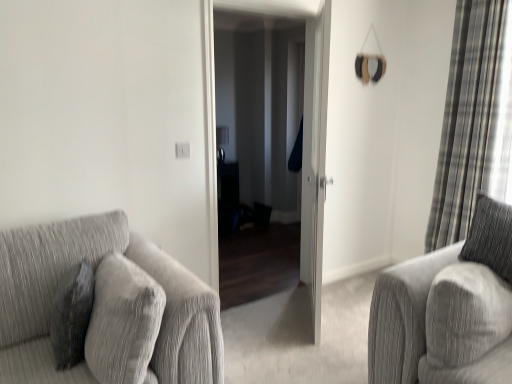
Question: Is white glossy door at center, placed as the first screen door when sorted from right to left, located outside textured gray couch at left?

Choices:
 (A) no
 (B) yes

Answer: (B)

Question: From the image's perspective, would you say white glossy door at center, placed as the second screen door when sorted from left to right, is shown under textured gray couch at left?

Choices:
 (A) no
 (B) yes

Answer: (A)

Question: Would you say textured gray couch at left is part of white glossy door at center, placed as the first screen door when sorted from right to left,'s contents?

Choices:
 (A) no
 (B) yes

Answer: (A)

Question: Can you confirm if white glossy door at center, placed as the second screen door when sorted from left to right, is taller than textured gray couch at left?

Choices:
 (A) yes
 (B) no

Answer: (A)

Question: From a real-world perspective, is white glossy door at center, placed as the first screen door when sorted from right to left, physically below textured gray couch at left?

Choices:
 (A) no
 (B) yes

Answer: (A)

Question: Looking at the image, does plaid fabric curtain at right seem bigger or smaller compared to white glossy door at center, placed as the first screen door when sorted from right to left?

Choices:
 (A) small
 (B) big

Answer: (B)

Question: In the image, is plaid fabric curtain at right positioned in front of or behind white glossy door at center, placed as the first screen door when sorted from right to left?

Choices:
 (A) behind
 (B) front

Answer: (A)

Question: Is point (501, 127) positioned closer to the camera than point (309, 129)?

Choices:
 (A) farther
 (B) closer

Answer: (B)

Question: From the image's perspective, is plaid fabric curtain at right positioned above or below white glossy door at center, placed as the second screen door when sorted from left to right?

Choices:
 (A) above
 (B) below

Answer: (A)

Question: Considering the positions of textured gray couch at left and matte black screen door at center, arranged as the 1th screen door when viewed from the left, in the image, is textured gray couch at left bigger or smaller than matte black screen door at center, arranged as the 1th screen door when viewed from the left,?

Choices:
 (A) small
 (B) big

Answer: (B)

Question: Is textured gray couch at left wider or thinner than matte black screen door at center, the second screen door viewed from the right?

Choices:
 (A) wide
 (B) thin

Answer: (A)

Question: Is textured gray couch at left in front of or behind matte black screen door at center, arranged as the 1th screen door when viewed from the left, in the image?

Choices:
 (A) front
 (B) behind

Answer: (A)

Question: Is textured gray couch at left inside the boundaries of matte black screen door at center, arranged as the 1th screen door when viewed from the left, or outside?

Choices:
 (A) inside
 (B) outside

Answer: (B)

Question: Choose the correct answer: Is textured gray couch at left inside plaid fabric curtain at right or outside it?

Choices:
 (A) inside
 (B) outside

Answer: (B)

Question: From their relative heights in the image, would you say textured gray couch at left is taller or shorter than plaid fabric curtain at right?

Choices:
 (A) short
 (B) tall

Answer: (A)